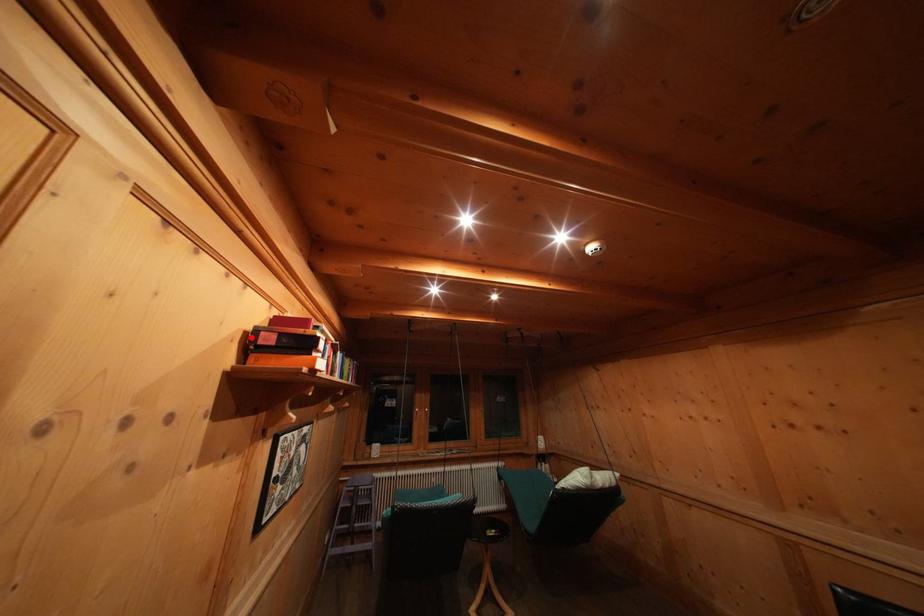
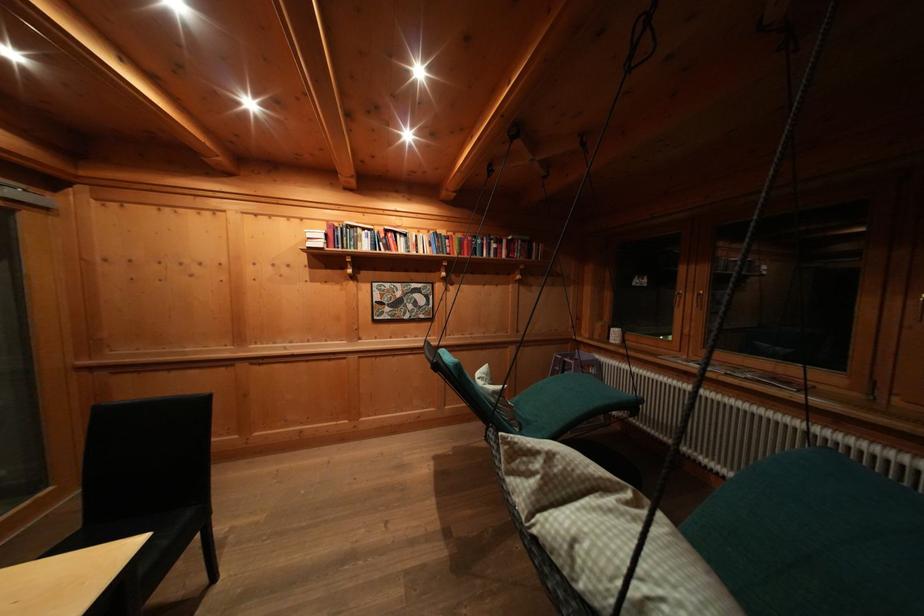
Question: I am providing you with two images of the same scene from different viewpoints. A red point is marked on the first image. Can you still see the location of the red point in image 2?

Choices:
 (A) Yes
 (B) No

Answer: (B)